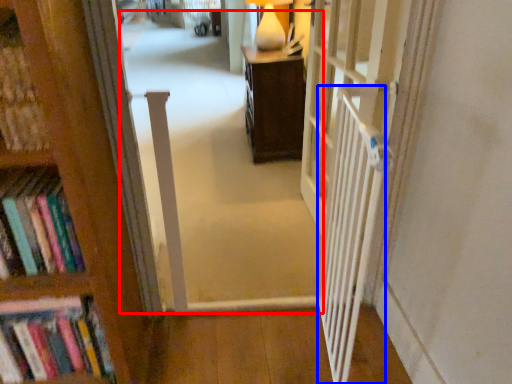
Question: Which object appears farthest to the camera in this image, corridor (highlighted by a red box) or balustrade (highlighted by a blue box)?

Choices:
 (A) corridor
 (B) balustrade

Answer: (A)